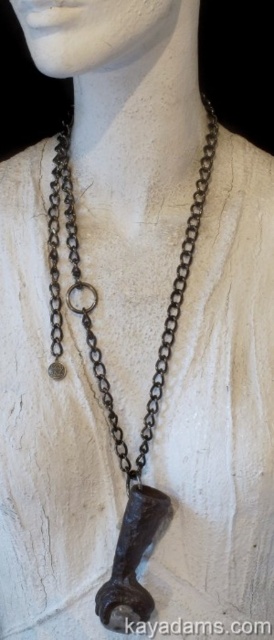
Question: Estimate the real-world distances between objects in this image. Which object is closer to the white matte head at center?

Choices:
 (A) matte black clasp at center
 (B) rusty chain at center

Answer: (B)

Question: Based on their relative distances, which object is nearer to the rusty chain at center?

Choices:
 (A) white matte head at center
 (B) matte black clasp at center

Answer: (B)

Question: In this image, where is white matte head at center located relative to matte black clasp at center?

Choices:
 (A) left
 (B) right

Answer: (A)

Question: Where is rusty chain at center located in relation to white matte head at center in the image?

Choices:
 (A) below
 (B) above

Answer: (A)

Question: Is rusty chain at center bigger than matte black clasp at center?

Choices:
 (A) yes
 (B) no

Answer: (A)

Question: Which of the following is the farthest from the observer?

Choices:
 (A) tap(118, 13)
 (B) tap(107, 605)
 (C) tap(106, 394)

Answer: (C)